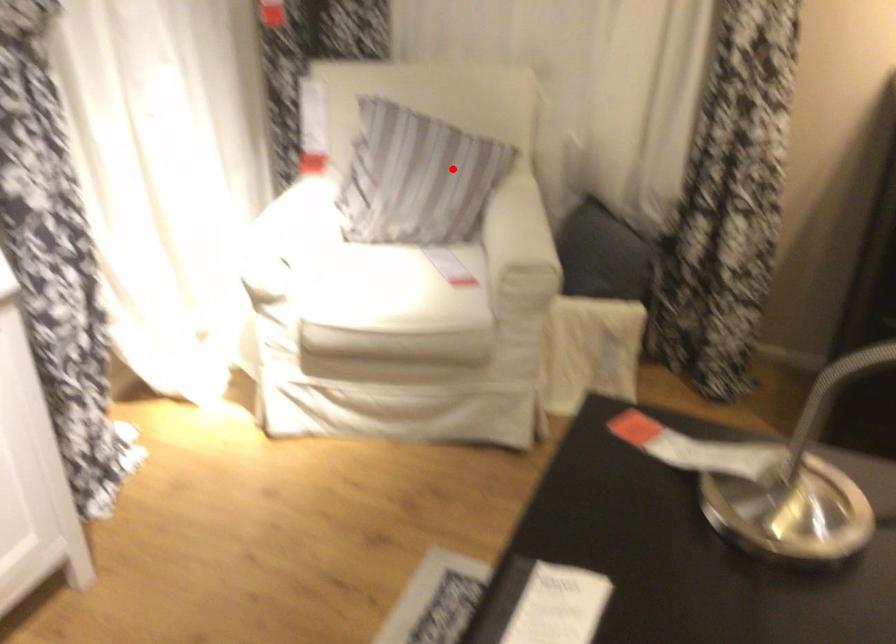
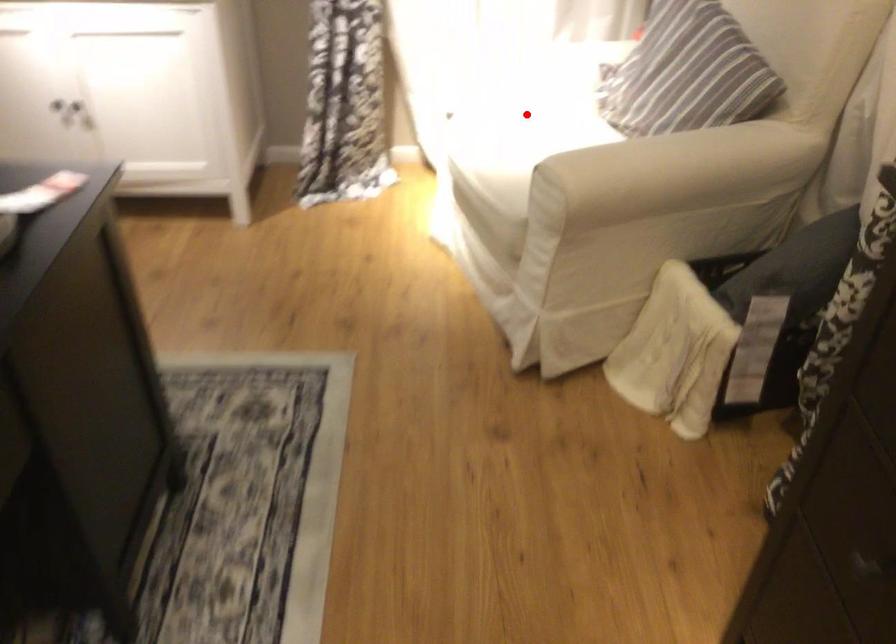
I am providing you with two images of the same scene from different viewpoints. A red point is marked on the first image and another point is marked on the second image. Do the highlighted points in image1 and image2 indicate the same real-world spot?

No